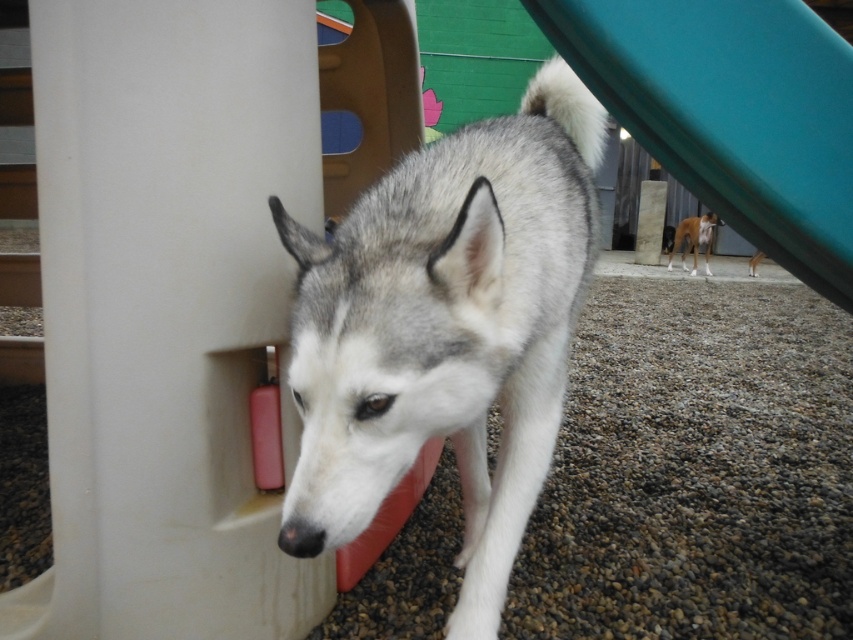
Question: Which of the following is the closest to the observer?

Choices:
 (A) (363, 513)
 (B) (692, 252)
 (C) (828, 188)
 (D) (751, 256)

Answer: (A)

Question: Observing the image, what is the correct spatial positioning of light brown fur at center in reference to brown fur dog at center?

Choices:
 (A) left
 (B) right

Answer: (A)

Question: Based on their relative distances, which object is farther from the brown fur dog at center?

Choices:
 (A) light brown fur at center
 (B) green plastic slide at upper right
 (C) gray fur dog at center

Answer: (C)

Question: Does gray fur dog at center lie behind green plastic slide at upper right?

Choices:
 (A) yes
 (B) no

Answer: (B)

Question: Estimate the real-world distances between objects in this image. Which object is farther from the brown fur dog at center?

Choices:
 (A) green plastic slide at upper right
 (B) gray fur dog at center

Answer: (B)

Question: Observing the image, what is the correct spatial positioning of gray fur dog at center in reference to light brown fur at center?

Choices:
 (A) above
 (B) below

Answer: (B)